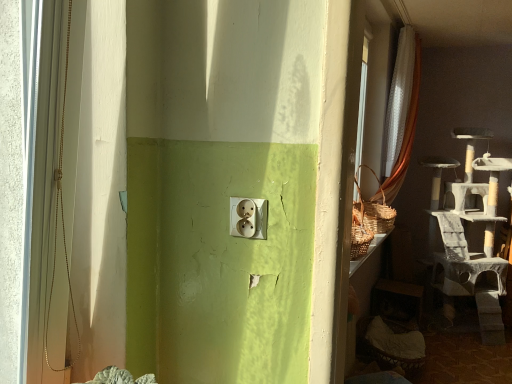
Question: Is white sheer curtain at upper right at the left side of matte white outlet at center?

Choices:
 (A) no
 (B) yes

Answer: (A)

Question: Are white sheer curtain at upper right and matte white outlet at center beside each other?

Choices:
 (A) yes
 (B) no

Answer: (B)

Question: Is white sheer curtain at upper right positioned with its back to matte white outlet at center?

Choices:
 (A) no
 (B) yes

Answer: (A)

Question: Does white sheer curtain at upper right have a smaller size compared to matte white outlet at center?

Choices:
 (A) yes
 (B) no

Answer: (B)

Question: Is white sheer curtain at upper right far away from matte white outlet at center?

Choices:
 (A) no
 (B) yes

Answer: (B)

Question: Is matte white outlet at center a part of white sheer curtain at upper right?

Choices:
 (A) yes
 (B) no

Answer: (B)

Question: Could white sheer curtain at upper right be considered to be inside matte white outlet at center?

Choices:
 (A) no
 (B) yes

Answer: (A)

Question: Considering the relative sizes of matte white outlet at center and white sheer curtain at upper right in the image provided, is matte white outlet at center wider than white sheer curtain at upper right?

Choices:
 (A) yes
 (B) no

Answer: (B)

Question: Does matte white outlet at center come behind white sheer curtain at upper right?

Choices:
 (A) no
 (B) yes

Answer: (A)

Question: Is matte white outlet at center oriented away from white sheer curtain at upper right?

Choices:
 (A) no
 (B) yes

Answer: (B)

Question: Considering the relative sizes of matte white outlet at center and white sheer curtain at upper right in the image provided, is matte white outlet at center smaller than white sheer curtain at upper right?

Choices:
 (A) yes
 (B) no

Answer: (A)

Question: From the image's perspective, does matte white outlet at center appear higher than white sheer curtain at upper right?

Choices:
 (A) no
 (B) yes

Answer: (A)

Question: From a real-world perspective, is matte white outlet at center physically located above or below white sheer curtain at upper right?

Choices:
 (A) below
 (B) above

Answer: (A)